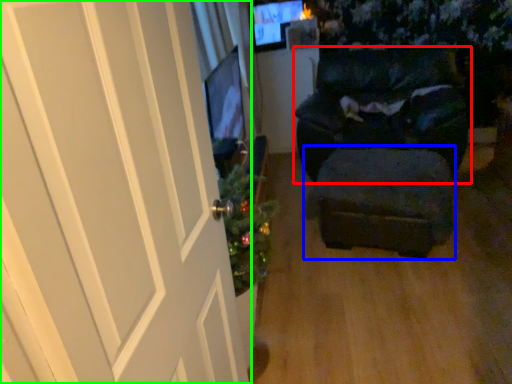
Question: Which is farther away from furniture (highlighted by a red box)? stool (highlighted by a blue box) or door (highlighted by a green box)?

Choices:
 (A) stool
 (B) door

Answer: (B)